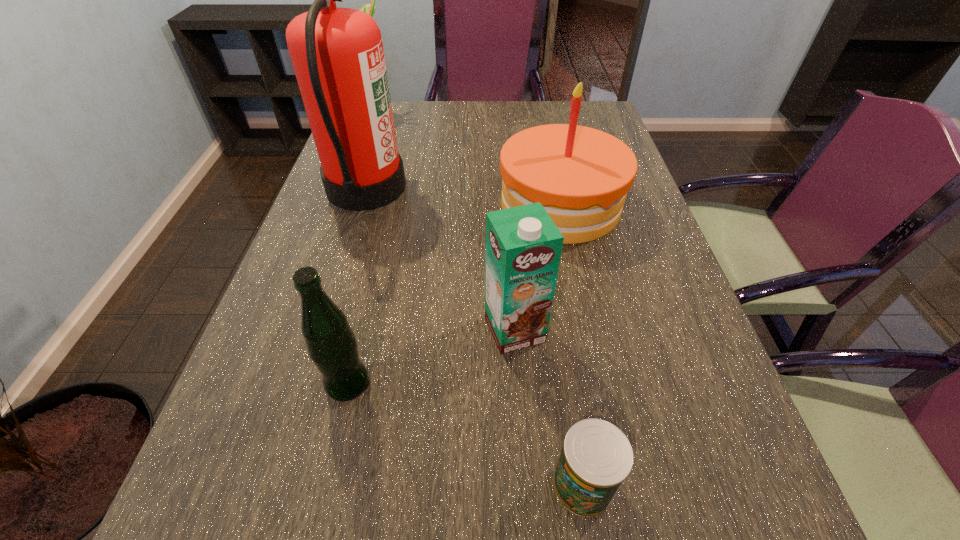
Identify the location of fire extinguisher. The height and width of the screenshot is (540, 960). (337, 54).

What are the coordinates of `the farthest object` in the screenshot? It's located at (367, 8).

This screenshot has height=540, width=960. What are the coordinates of `birthday cake` in the screenshot? It's located at coord(580,175).

Find the location of `the third nearest object`. the third nearest object is located at coordinates (523, 245).

Locate an element on the screen. the fifth farthest object is located at coordinates (332, 346).

Find the location of a particular element. Image resolution: width=960 pixels, height=540 pixels. the nearest object is located at coordinates (596, 458).

What are the coordinates of `can` in the screenshot? It's located at point(596,458).

This screenshot has width=960, height=540. I want to click on vacant space located 0.230m at the nozzle of the tallest object, so click(x=488, y=186).

Where is `vacant space located 0.090m on the front of the alcohol`? vacant space located 0.090m on the front of the alcohol is located at coordinates (368, 138).

Locate an element on the screen. Image resolution: width=960 pixels, height=540 pixels. free spot located on the back of the birthday cake is located at coordinates [550, 155].